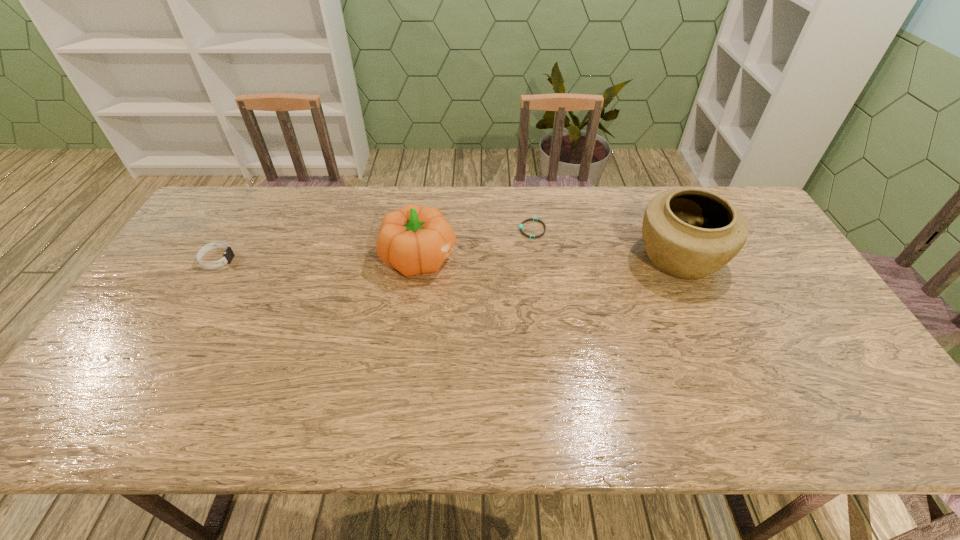
You are a GUI agent. You are given a task and a screenshot of the screen. Output one action in this format:
    pyautogui.click(x=<x>, y=<y>)
    Task: Click on the blank space located 0.300m on the buckle of the shortest object
    The width and height of the screenshot is (960, 540).
    Given the screenshot: What is the action you would take?
    pyautogui.click(x=426, y=230)

Find the location of a particular element. This screenshot has width=960, height=540. free space located 0.090m on the buckle of the shortest object is located at coordinates (491, 230).

Locate an element on the screen. Image resolution: width=960 pixels, height=540 pixels. pottery that is positioned at the far edge is located at coordinates (688, 233).

Where is `wristband that is at the far edge`? The height and width of the screenshot is (540, 960). wristband that is at the far edge is located at coordinates [530, 219].

I want to click on object positioned at the left edge, so click(x=228, y=255).

This screenshot has height=540, width=960. I want to click on vacant point at the far edge, so click(588, 214).

Find the location of a particular element. The width and height of the screenshot is (960, 540). vacant area at the near edge of the desktop is located at coordinates (333, 407).

Image resolution: width=960 pixels, height=540 pixels. Find the location of `free space at the left edge of the desktop`. free space at the left edge of the desktop is located at coordinates (210, 237).

This screenshot has width=960, height=540. Identify the location of vacant space at the right edge of the desktop. (846, 363).

Image resolution: width=960 pixels, height=540 pixels. In the image, there is a desktop. Find the location of `free space at the far left corner`. free space at the far left corner is located at coordinates (215, 220).